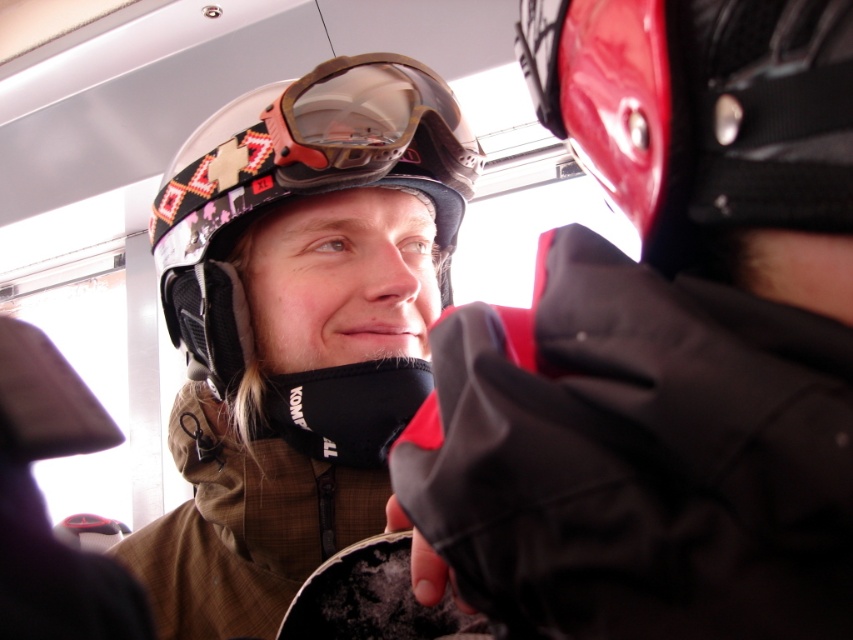
You are a safety inspector checking equipment sizes for a winter sports team. According to the image, which object is larger between the matte black helmet at upper left and the matte black goggles at center?

The matte black helmet at upper left is bigger than the matte black goggles at center.